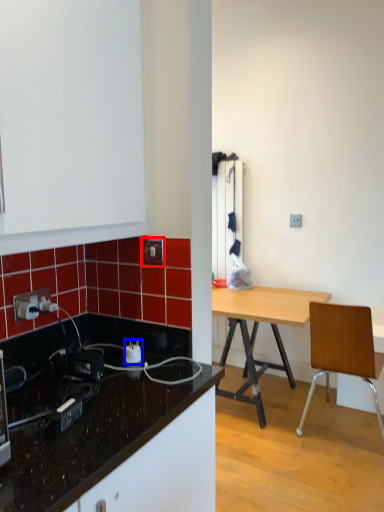
Question: Which object is closer to the camera taking this photo, electric outlet (highlighted by a red box) or power plugs and sockets (highlighted by a blue box)?

Choices:
 (A) electric outlet
 (B) power plugs and sockets

Answer: (B)